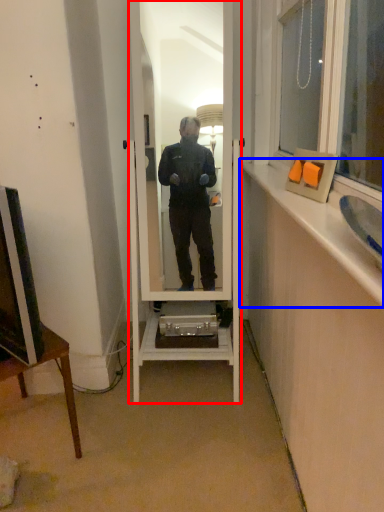
Question: Which object is closer to the camera taking this photo, mirror (highlighted by a red box) or window sill (highlighted by a blue box)?

Choices:
 (A) mirror
 (B) window sill

Answer: (B)